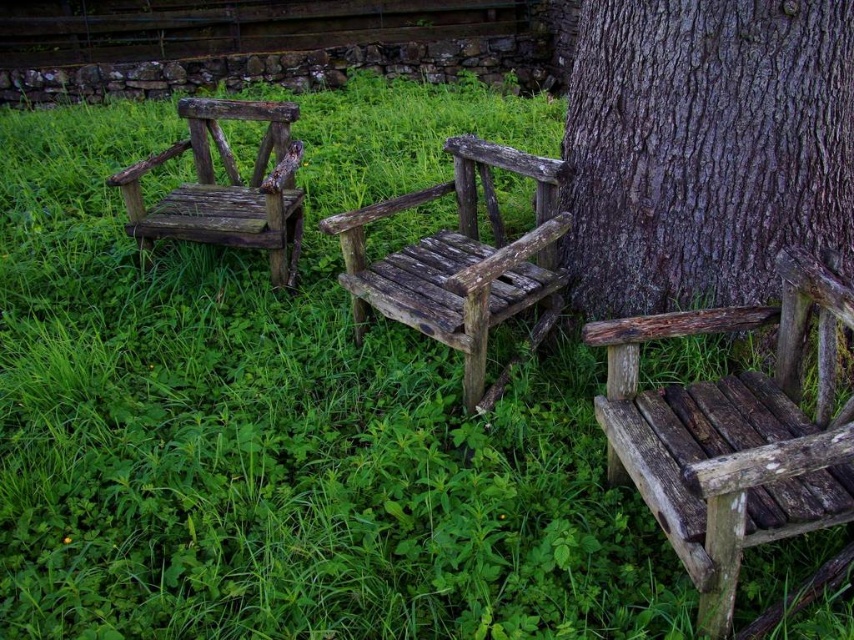
From the picture: Is dark brown textured bark at right wider than weathered wood bench at right?

Yes, dark brown textured bark at right is wider than weathered wood bench at right.

Is point (640, 240) positioned after point (733, 531)?

Yes, point (640, 240) is behind point (733, 531).

This screenshot has width=854, height=640. Describe the element at coordinates (705, 148) in the screenshot. I see `dark brown textured bark at right` at that location.

In order to click on dark brown textured bark at right in this screenshot , I will do `click(705, 148)`.

Which is behind, point (418, 248) or point (270, 140)?

The point (270, 140) is behind.

Which is more to the right, weathered wood chair at center or weathered wood chair at left?

weathered wood chair at center is more to the right.

Does point (483, 358) come closer to viewer compared to point (196, 113)?

Yes, point (483, 358) is in front of point (196, 113).

Where is `weathered wood chair at center`? weathered wood chair at center is located at coordinates point(461,262).

Which is more to the right, weathered wood bench at right or weathered wood chair at left?

Positioned to the right is weathered wood bench at right.

Which is above, weathered wood bench at right or weathered wood chair at left?

weathered wood chair at left is above.

Locate an element on the screen. weathered wood bench at right is located at coordinates (733, 435).